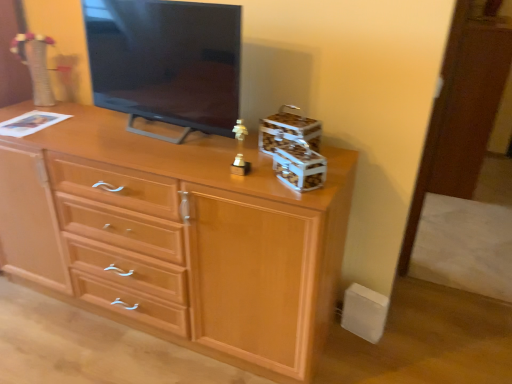
Where is `matte black tv at center`? The image size is (512, 384). matte black tv at center is located at coordinates [166, 62].

This screenshot has width=512, height=384. I want to click on light wood chest of drawers at center, so click(x=178, y=238).

Find the location of `matte black tv at center`. matte black tv at center is located at coordinates (166, 62).

Between metallic silver storage box at center-right, placed as the 1th storage box when sorted from front to back, and light wood chest of drawers at center, which one has smaller width?

metallic silver storage box at center-right, placed as the 1th storage box when sorted from front to back.

Is metallic silver storage box at center-right, marked as the second storage box in a back-to-front arrangement, directly adjacent to light wood chest of drawers at center?

No, metallic silver storage box at center-right, marked as the second storage box in a back-to-front arrangement, is not with light wood chest of drawers at center.

Which object is positioned more to the left, metallic silver storage box at center-right, placed as the 1th storage box when sorted from front to back, or light wood chest of drawers at center?

Positioned to the left is light wood chest of drawers at center.

Which of these two, metallic silver storage box at center-right, placed as the 1th storage box when sorted from front to back, or light wood chest of drawers at center, is bigger?

Bigger between the two is light wood chest of drawers at center.

Considering the sizes of objects light wood chest of drawers at center and wooden storage box at upper right, the first storage box in the back-to-front sequence, in the image provided, who is smaller, light wood chest of drawers at center or wooden storage box at upper right, the first storage box in the back-to-front sequence,?

wooden storage box at upper right, the first storage box in the back-to-front sequence.

Is light wood chest of drawers at center next to wooden storage box at upper right, the first storage box in the back-to-front sequence, and touching it?

No, light wood chest of drawers at center is not with wooden storage box at upper right, the first storage box in the back-to-front sequence.

I want to click on the 2nd storage box positioned above the light wood chest of drawers at center (from a real-world perspective), so click(288, 130).

Between light wood chest of drawers at center and wooden storage box at upper right, which ranks as the 2th storage box in front-to-back order, which one has larger width?

light wood chest of drawers at center is wider.

Is there a large distance between light wood chest of drawers at center and matte black tv at center?

No, light wood chest of drawers at center is not far from matte black tv at center.

From the picture: Considering the sizes of light wood chest of drawers at center and matte black tv at center in the image, is light wood chest of drawers at center wider or thinner than matte black tv at center?

In the image, light wood chest of drawers at center appears to be wider than matte black tv at center.

Locate an element on the screen. Image resolution: width=512 pixels, height=384 pixels. chest of drawers in front of the matte black tv at center is located at coordinates (178, 238).

Locate an element on the screen. storage box in front of the matte black tv at center is located at coordinates (298, 166).

From the image's perspective, is matte black tv at center below metallic silver storage box at center-right, marked as the second storage box in a back-to-front arrangement?

Actually, matte black tv at center appears above metallic silver storage box at center-right, marked as the second storage box in a back-to-front arrangement, in the image.

Which is correct: matte black tv at center is inside metallic silver storage box at center-right, marked as the second storage box in a back-to-front arrangement, or outside of it?

matte black tv at center lies outside metallic silver storage box at center-right, marked as the second storage box in a back-to-front arrangement.

Is point (300, 144) more distant than point (279, 124)?

That is False.

Can you confirm if metallic silver storage box at center-right, placed as the 1th storage box when sorted from front to back, is bigger than wooden storage box at upper right, which ranks as the 2th storage box in front-to-back order?

Actually, metallic silver storage box at center-right, placed as the 1th storage box when sorted from front to back, might be smaller than wooden storage box at upper right, which ranks as the 2th storage box in front-to-back order.

From the picture: Can you confirm if metallic silver storage box at center-right, marked as the second storage box in a back-to-front arrangement, is shorter than wooden storage box at upper right, the first storage box in the back-to-front sequence?

Yes, metallic silver storage box at center-right, marked as the second storage box in a back-to-front arrangement, is shorter than wooden storage box at upper right, the first storage box in the back-to-front sequence.

Is wooden storage box at upper right, the first storage box in the back-to-front sequence, to the left of matte black tv at center from the viewer's perspective?

No.

Is wooden storage box at upper right, which ranks as the 2th storage box in front-to-back order, taller than matte black tv at center?

No, wooden storage box at upper right, which ranks as the 2th storage box in front-to-back order, is not taller than matte black tv at center.

Is wooden storage box at upper right, which ranks as the 2th storage box in front-to-back order, next to matte black tv at center?

wooden storage box at upper right, which ranks as the 2th storage box in front-to-back order, is not next to matte black tv at center, and they're not touching.

From the image's perspective, is metallic silver storage box at center-right, marked as the second storage box in a back-to-front arrangement, located above or below matte black tv at center?

metallic silver storage box at center-right, marked as the second storage box in a back-to-front arrangement, is situated lower than matte black tv at center in the image.

Looking at this image, does metallic silver storage box at center-right, placed as the 1th storage box when sorted from front to back, have a lesser height compared to matte black tv at center?

Correct, metallic silver storage box at center-right, placed as the 1th storage box when sorted from front to back, is not as tall as matte black tv at center.

Is metallic silver storage box at center-right, marked as the second storage box in a back-to-front arrangement, looking in the opposite direction of matte black tv at center?

metallic silver storage box at center-right, marked as the second storage box in a back-to-front arrangement, is not turned away from matte black tv at center.

From a real-world perspective, between metallic silver storage box at center-right, marked as the second storage box in a back-to-front arrangement, and matte black tv at center, who is vertically higher?

From a 3D spatial view, matte black tv at center is above.

Which storage box is the 2nd one when counting from the right side of the light wood chest of drawers at center? Please provide its 2D coordinates.

[(298, 166)]

From a real-world perspective, starting from the light wood chest of drawers at center, which storage box is the 2nd one vertically above it? Please provide its 2D coordinates.

[(288, 130)]

Estimate the real-world distances between objects in this image. Which object is further from metallic silver storage box at center-right, marked as the second storage box in a back-to-front arrangement, light wood chest of drawers at center or matte black tv at center?

light wood chest of drawers at center is positioned further to the anchor metallic silver storage box at center-right, marked as the second storage box in a back-to-front arrangement.

When comparing their distances from wooden storage box at upper right, which ranks as the 2th storage box in front-to-back order, does metallic silver storage box at center-right, placed as the 1th storage box when sorted from front to back, or light wood chest of drawers at center seem closer?

metallic silver storage box at center-right, placed as the 1th storage box when sorted from front to back.

Looking at this image, from the image, which object appears to be nearer to metallic silver storage box at center-right, placed as the 1th storage box when sorted from front to back, wooden storage box at upper right, which ranks as the 2th storage box in front-to-back order, or matte black tv at center?

wooden storage box at upper right, which ranks as the 2th storage box in front-to-back order, is positioned closer to the anchor metallic silver storage box at center-right, placed as the 1th storage box when sorted from front to back.

Based on the photo, based on their spatial positions, is light wood chest of drawers at center or metallic silver storage box at center-right, placed as the 1th storage box when sorted from front to back, closer to matte black tv at center?

light wood chest of drawers at center lies closer to matte black tv at center than the other object.

Looking at the image, which one is located further to light wood chest of drawers at center, wooden storage box at upper right, the first storage box in the back-to-front sequence, or matte black tv at center?

Based on the image, wooden storage box at upper right, the first storage box in the back-to-front sequence, appears to be further to light wood chest of drawers at center.

Estimate the real-world distances between objects in this image. Which object is closer to light wood chest of drawers at center, matte black tv at center or metallic silver storage box at center-right, marked as the second storage box in a back-to-front arrangement?

matte black tv at center is closer to light wood chest of drawers at center.

Based on their spatial positions, is wooden storage box at upper right, which ranks as the 2th storage box in front-to-back order, or metallic silver storage box at center-right, placed as the 1th storage box when sorted from front to back, closer to matte black tv at center?

Based on the image, wooden storage box at upper right, which ranks as the 2th storage box in front-to-back order, appears to be nearer to matte black tv at center.

Based on their spatial positions, is metallic silver storage box at center-right, placed as the 1th storage box when sorted from front to back, or matte black tv at center further from wooden storage box at upper right, the first storage box in the back-to-front sequence?

matte black tv at center lies further to wooden storage box at upper right, the first storage box in the back-to-front sequence, than the other object.

I want to click on storage box situated between light wood chest of drawers at center and metallic silver storage box at center-right, marked as the second storage box in a back-to-front arrangement, from left to right, so click(x=288, y=130).

I want to click on storage box between matte black tv at center and metallic silver storage box at center-right, marked as the second storage box in a back-to-front arrangement, so click(x=288, y=130).